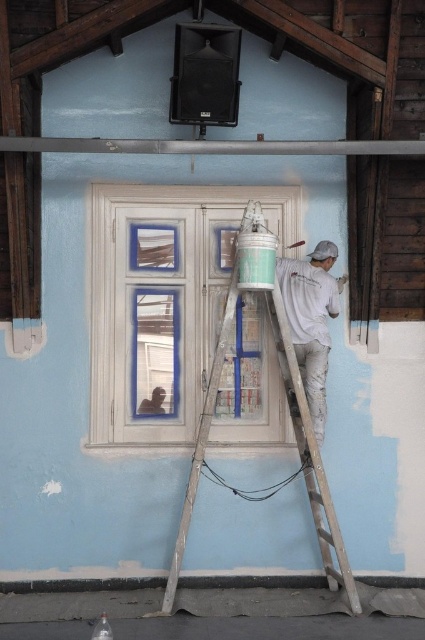
You are a painter who needs to reach the window to remove the painter tape. The wooden ladder at center and the white matte shirt at right are in your view. Which object should you approach first to safely reach the window?

You should approach the wooden ladder at center first because it is closer to you than the white matte shirt at right, allowing you to safely reach the window.

You are a safety inspector reviewing this painting scene. The safety guidelines state that workers must wear protective gear, including a safety harness when working above 2 meters. The ladder in the scene reaches up to 3 meters. Can you determine if the worker wearing the white matte shirt at right is at a height requiring a safety harness based on their position?

The white matte shirt at right is located at point 0.732 on the y axis, which corresponds to approximately 2.2 meters in height. Since the ladder reaches up to 3 meters and the worker is above 2 meters, they should be using a safety harness according to the guidelines.

You are a painter working on the exterior wall. You need to move your ladder closer to the area you are painting. Which direction should you move the wooden ladder at center so that it aligns with the white painted wood at center?

The white painted wood at center is to the left of the wooden ladder at center, so you should move the wooden ladder at center to the left to align it with the white painted wood at center.